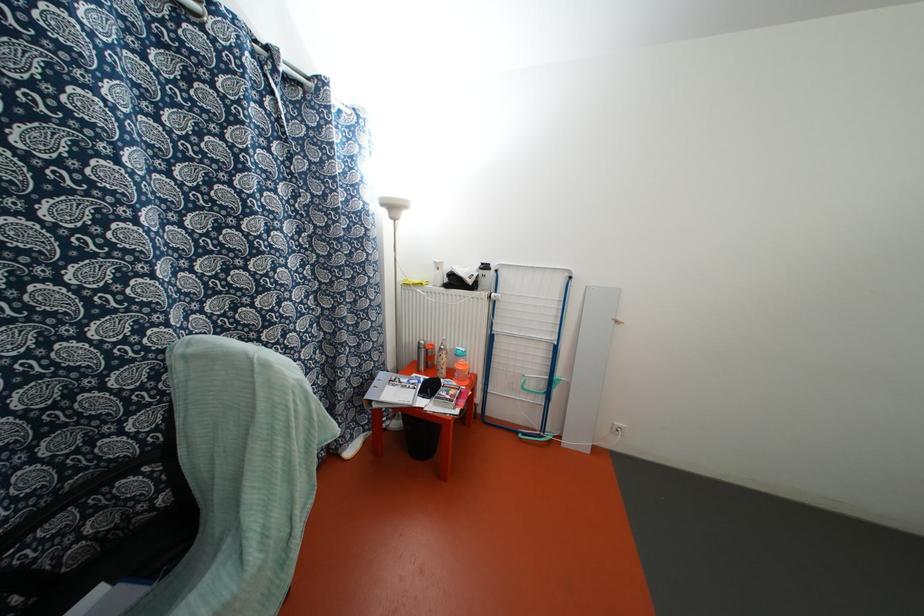
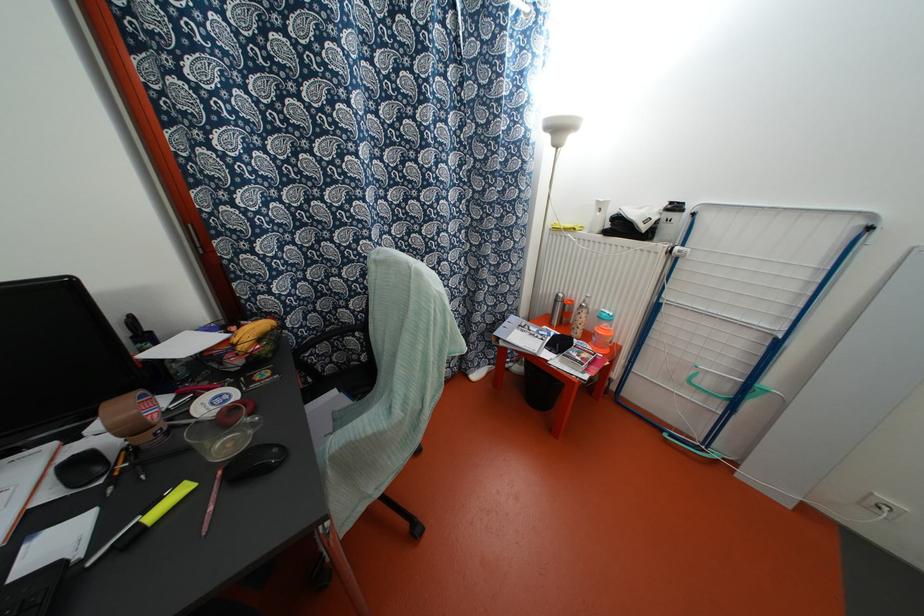
Find the pixel in the second image that matches the point at 419,347 in the first image.

(554, 301)